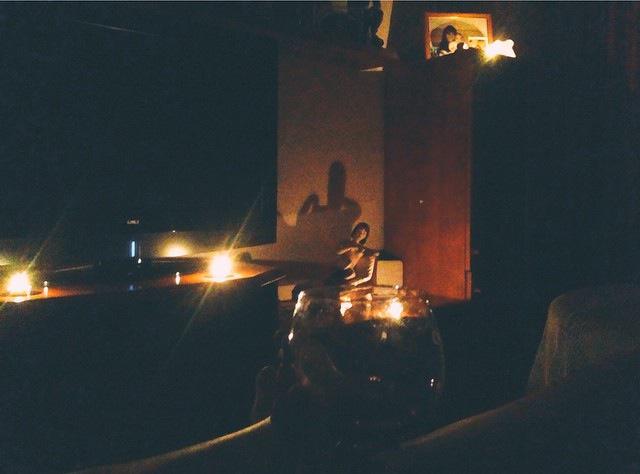
The width and height of the screenshot is (640, 474). What are the coordinates of `white lace table cloth` in the screenshot? It's located at (564, 339).